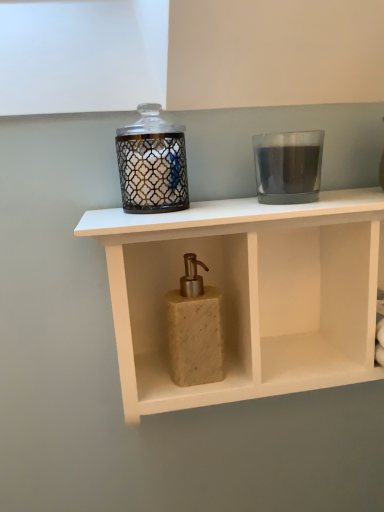
Locate an element on the screen. The width and height of the screenshot is (384, 512). free spot in front of transparent glass candle at upper right, the second candle holder positioned from the left is located at coordinates (287, 207).